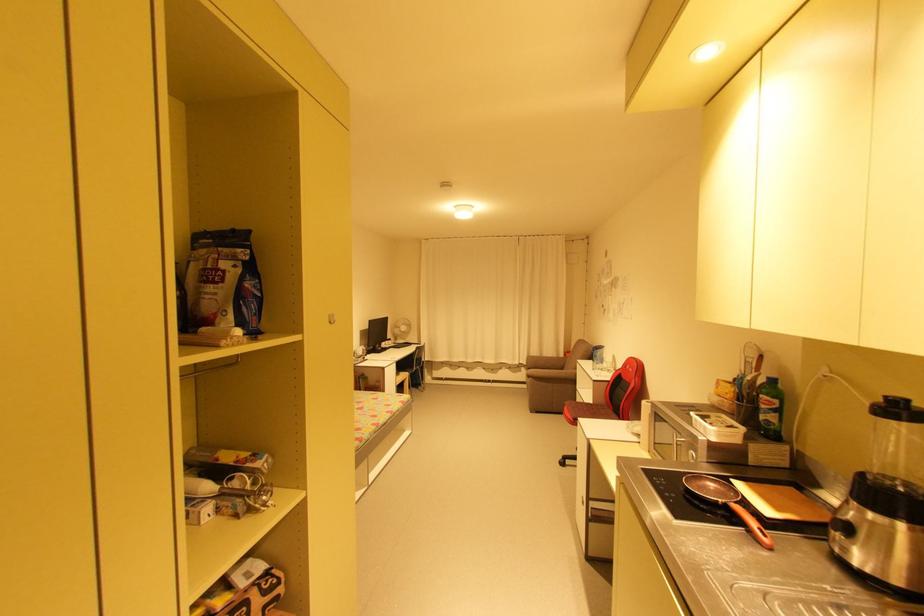
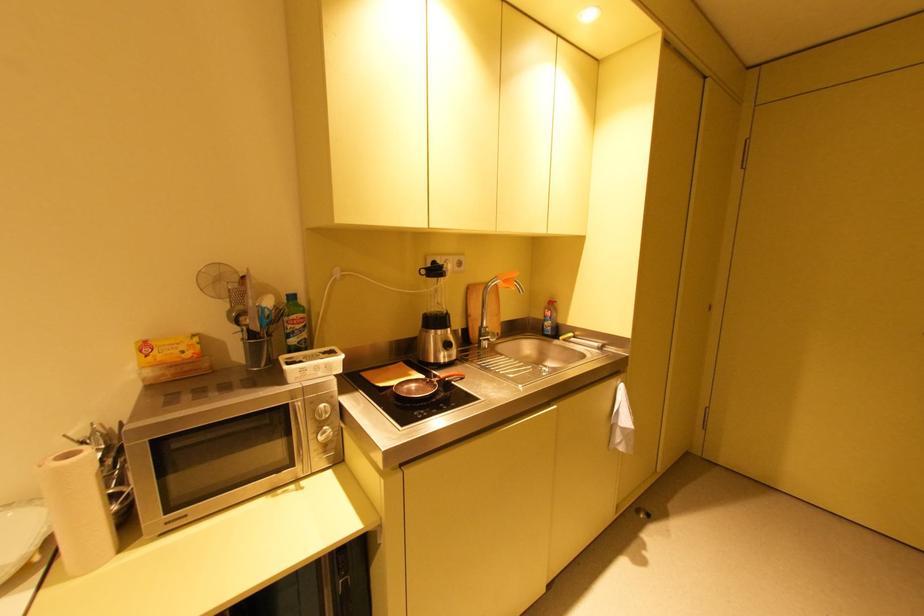
The point at (720,490) is marked in the first image. Where is the corresponding point in the second image?

(420, 387)